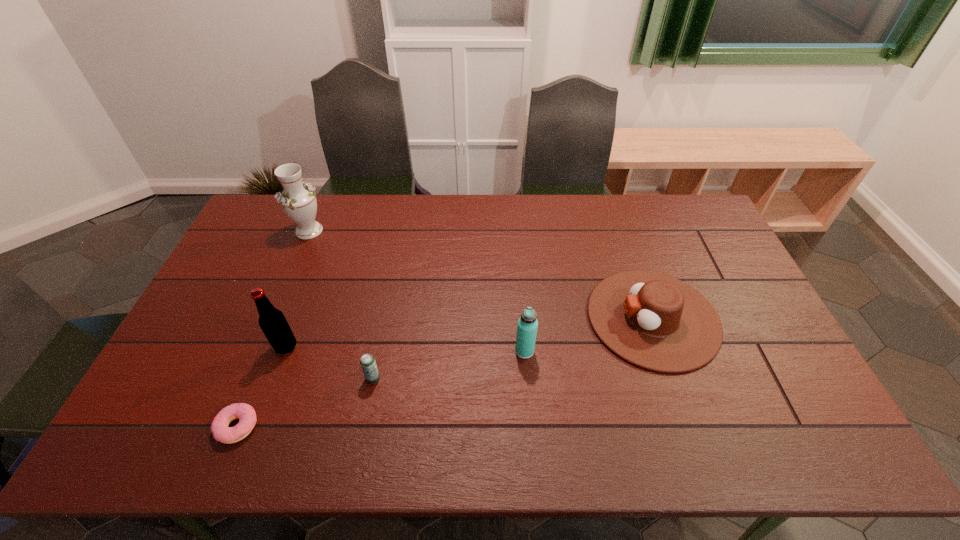
The image size is (960, 540). Find the location of `the farthest object`. the farthest object is located at coordinates (298, 201).

Where is `beer bottle`? The image size is (960, 540). beer bottle is located at coordinates (272, 321).

At what (x,y) coordinates should I click in order to perform the action: click on the second object from right to left. Please return your answer as a coordinate pair (x, y). The image size is (960, 540). Looking at the image, I should click on (527, 325).

Identify the location of the fourth shortest object. Image resolution: width=960 pixels, height=540 pixels. (527, 325).

Where is `cowboy hat`? The width and height of the screenshot is (960, 540). cowboy hat is located at coordinates click(x=652, y=320).

This screenshot has width=960, height=540. Identify the location of beer can. pyautogui.click(x=368, y=364).

Locate an element on the screen. The width and height of the screenshot is (960, 540). the second shortest object is located at coordinates (368, 364).

I want to click on the nearest object, so click(x=244, y=412).

Identify the location of doughnut. Image resolution: width=960 pixels, height=540 pixels. (244, 412).

The image size is (960, 540). Find the location of `vacant space located 0.350m on the front of the farthest object`. vacant space located 0.350m on the front of the farthest object is located at coordinates (271, 323).